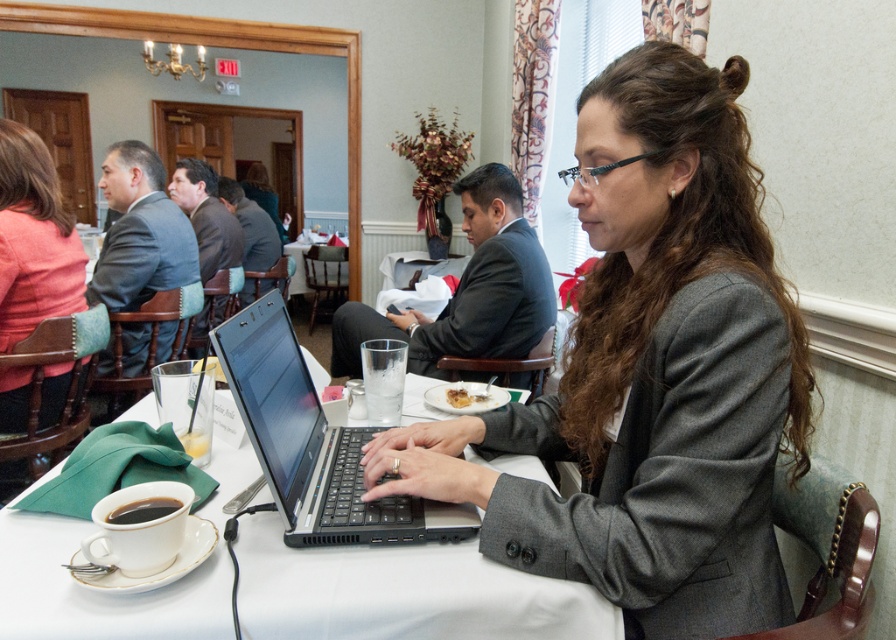
In the scene shown: You are organizing a presentation and need to place both the black matte laptop at center and the slightly browned bread at center on a small tray. Which object should you place first to ensure both fit?

The black matte laptop at center is larger than the slightly browned bread at center, so you should place the black matte laptop at center first to ensure both fit on the small tray.

You are organizing a presentation and need to place a projector remote next to the black matte laptop at center. Where should you position the remote to ensure it is easily accessible without obstructing the laptop?

The black matte laptop at center is located at point (315, 444), so place the remote next to this coordinate to keep it accessible and unobstructed.